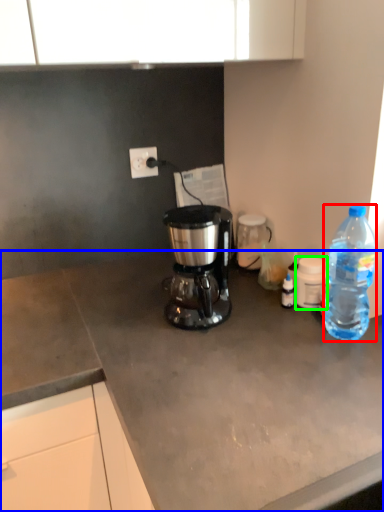
Question: Considering the real-world distances, which object is farthest from bottle (highlighted by a red box)? desk (highlighted by a blue box) or coffee cup (highlighted by a green box)?

Choices:
 (A) desk
 (B) coffee cup

Answer: (A)